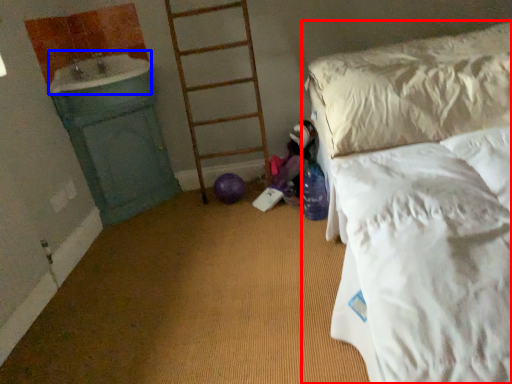
Question: Which object appears closest to the camera in this image, bed (highlighted by a red box) or sink (highlighted by a blue box)?

Choices:
 (A) bed
 (B) sink

Answer: (A)